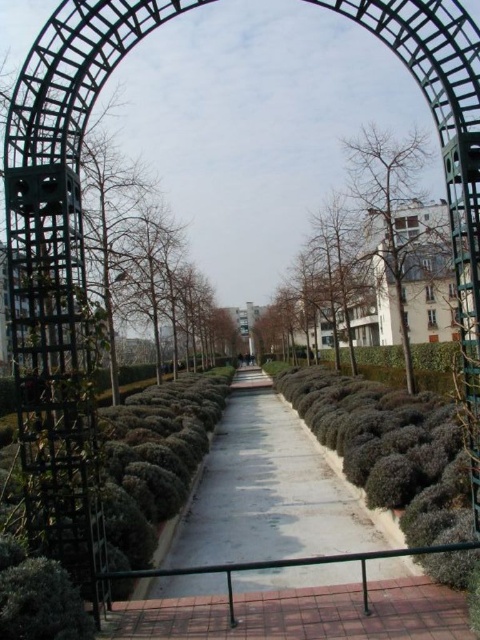
Question: Which object appears farthest from the camera in this image?

Choices:
 (A) bare branches at center
 (B) smooth concrete path at center

Answer: (A)

Question: Is smooth concrete path at center further to the viewer compared to bare branches at center?

Choices:
 (A) yes
 (B) no

Answer: (B)

Question: Can you confirm if smooth concrete path at center is thinner than bare branches at center?

Choices:
 (A) yes
 (B) no

Answer: (B)

Question: Where is smooth concrete path at center located in relation to bare branches at center in the image?

Choices:
 (A) left
 (B) right

Answer: (A)

Question: Which point is farther to the camera?

Choices:
 (A) (432, 282)
 (B) (302, 550)

Answer: (A)